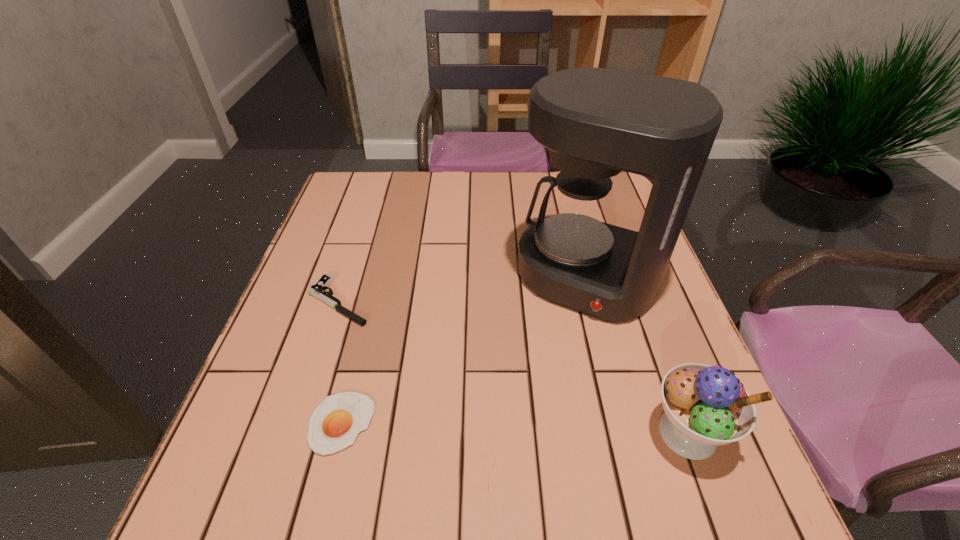
I want to click on blank area at the far edge, so click(459, 205).

Where is `vacant space at the near edge`? This screenshot has width=960, height=540. vacant space at the near edge is located at coordinates (573, 415).

Where is `vacant space at the left edge of the desktop`? The width and height of the screenshot is (960, 540). vacant space at the left edge of the desktop is located at coordinates (314, 244).

This screenshot has width=960, height=540. In the image, there is a desktop. In order to click on free space at the right edge in this screenshot , I will do `click(612, 331)`.

Identify the location of vacant area that lies between the icecream and the pistol. The height and width of the screenshot is (540, 960). (513, 367).

Locate an element on the screen. The image size is (960, 540). free area in between the icecream and the pistol is located at coordinates (513, 367).

Identify the location of free space between the pistol and the tallest object. (463, 289).

Find the location of a particular element. unoccupied area between the third shortest object and the pistol is located at coordinates (513, 367).

Find the location of a particular element. The image size is (960, 540). blank region between the second tallest object and the egg yolk is located at coordinates (515, 428).

This screenshot has width=960, height=540. I want to click on free spot between the tallest object and the shortest object, so pos(464,350).